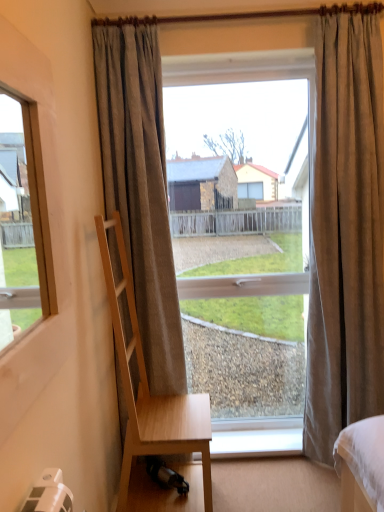
In order to face white plastic window sill at lower center, should I rotate leftwards or rightwards?

A 8.952 degree turn to the right will do.

Describe the element at coordinates (256, 437) in the screenshot. The height and width of the screenshot is (512, 384). I see `white plastic window sill at lower center` at that location.

The image size is (384, 512). Describe the element at coordinates (154, 410) in the screenshot. I see `light wood chair at left` at that location.

Find the location of `clear glass window at center`. clear glass window at center is located at coordinates (242, 227).

The width and height of the screenshot is (384, 512). What do you see at coordinates (242, 227) in the screenshot?
I see `clear glass window at center` at bounding box center [242, 227].

Where is `white plastic window sill at lower center`? The height and width of the screenshot is (512, 384). white plastic window sill at lower center is located at coordinates (256, 437).

From the image's perspective, which one is positioned higher, gray textured curtain at center, which is the first curtain in left-to-right order, or clear glass window at center?

From the image's view, clear glass window at center is above.

Where is `curtain that is below the clear glass window at center (from the image's perspective)`? The width and height of the screenshot is (384, 512). curtain that is below the clear glass window at center (from the image's perspective) is located at coordinates (140, 189).

Is gray textured curtain at center, which is the first curtain in left-to-right order, bigger than clear glass window at center?

No.

Between gray textured curtain at center, which is the first curtain in left-to-right order, and clear glass window at center, which one appears on the left side from the viewer's perspective?

gray textured curtain at center, which is the first curtain in left-to-right order.

From a real-world perspective, does white plastic window sill at lower center stand above clear glass window at center?

No, from a real-world perspective, white plastic window sill at lower center is not above clear glass window at center.

Which of these two, white plastic window sill at lower center or clear glass window at center, stands shorter?

With less height is white plastic window sill at lower center.

From the picture: Who is more distant, white plastic window sill at lower center or clear glass window at center?

white plastic window sill at lower center is further away from the camera.

From the image's perspective, between white plastic window sill at lower center and clear glass window at center, who is located below?

white plastic window sill at lower center, from the image's perspective.

Is clear glass window at center not close to white plastic window sill at lower center?

Yes, clear glass window at center is far from white plastic window sill at lower center.

Considering the positions of objects clear glass window at center and white plastic window sill at lower center in the image provided, who is in front, clear glass window at center or white plastic window sill at lower center?

clear glass window at center is closer to the camera.

Is clear glass window at center positioned with its back to white plastic window sill at lower center?

That's not correct — clear glass window at center is not looking away from white plastic window sill at lower center.

Consider the image. Between clear glass window at center and white plastic window sill at lower center, which one has larger width?

white plastic window sill at lower center.

Is brown textured curtain at right, which is the 2th curtain in left-to-right order, oriented towards white plastic window sill at lower center?

No, brown textured curtain at right, which is the 2th curtain in left-to-right order, is not turned towards white plastic window sill at lower center.

How far apart are brown textured curtain at right, the 1th curtain positioned from the right, and white plastic window sill at lower center?

brown textured curtain at right, the 1th curtain positioned from the right, and white plastic window sill at lower center are 26.43 inches apart.

Between brown textured curtain at right, which is the 2th curtain in left-to-right order, and white plastic window sill at lower center, which one has larger width?

Wider between the two is brown textured curtain at right, which is the 2th curtain in left-to-right order.

Which of these two, brown textured curtain at right, the 1th curtain positioned from the right, or white plastic window sill at lower center, stands taller?

Standing taller between the two is brown textured curtain at right, the 1th curtain positioned from the right.

Could you tell me if clear glass window at center is turned towards gray textured curtain at center, which is the first curtain in left-to-right order?

No.

From the image's perspective, is clear glass window at center over gray textured curtain at center, acting as the 2th curtain starting from the right?

Indeed, from the image's perspective, clear glass window at center is shown above gray textured curtain at center, acting as the 2th curtain starting from the right.

Which of these two, clear glass window at center or gray textured curtain at center, acting as the 2th curtain starting from the right, stands taller?

With more height is gray textured curtain at center, acting as the 2th curtain starting from the right.

From a real-world perspective, relative to gray textured curtain at center, which is the first curtain in left-to-right order, is clear glass window at center vertically above or below?

In terms of real-world spatial position, clear glass window at center is below gray textured curtain at center, which is the first curtain in left-to-right order.

Consider the image. Is light wood chair at left wider or thinner than white plastic window sill at lower center?

In the image, light wood chair at left appears to be wider than white plastic window sill at lower center.

From a real-world perspective, is light wood chair at left above or below white plastic window sill at lower center?

In terms of real-world spatial position, light wood chair at left is above white plastic window sill at lower center.

Considering the positions of points (153, 437) and (299, 449), is point (153, 437) farther from camera compared to point (299, 449)?

No.

You are a GUI agent. You are given a task and a screenshot of the screen. Output one action in this format:
    pyautogui.click(x=<x>, y=<y>)
    Task: Click on the chair lying on the left of white plastic window sill at lower center
    
    Given the screenshot: What is the action you would take?
    pyautogui.click(x=154, y=410)

The width and height of the screenshot is (384, 512). I want to click on chair that is in front of the brown textured curtain at right, the 1th curtain positioned from the right, so click(x=154, y=410).

Considering the relative positions of brown textured curtain at right, the 1th curtain positioned from the right, and light wood chair at left in the image provided, is brown textured curtain at right, the 1th curtain positioned from the right, to the left of light wood chair at left from the viewer's perspective?

In fact, brown textured curtain at right, the 1th curtain positioned from the right, is to the right of light wood chair at left.

What's the angular difference between brown textured curtain at right, the 1th curtain positioned from the right, and light wood chair at left's facing directions?

88 degrees separate the facing orientations of brown textured curtain at right, the 1th curtain positioned from the right, and light wood chair at left.

Is brown textured curtain at right, which is the 2th curtain in left-to-right order, spatially inside light wood chair at left, or outside of it?

brown textured curtain at right, which is the 2th curtain in left-to-right order, cannot be found inside light wood chair at left.

You are a GUI agent. You are given a task and a screenshot of the screen. Output one action in this format:
    pyautogui.click(x=<x>, y=<y>)
    Task: Click on the window behind the gray textured curtain at center, which is the first curtain in left-to-right order
    The height and width of the screenshot is (512, 384).
    Given the screenshot: What is the action you would take?
    pyautogui.click(x=242, y=227)

The image size is (384, 512). Find the location of `window above the white plastic window sill at lower center (from the image's perspective)`. window above the white plastic window sill at lower center (from the image's perspective) is located at coordinates (242, 227).

Based on their spatial positions, is gray textured curtain at center, which is the first curtain in left-to-right order, or brown textured curtain at right, which is the 2th curtain in left-to-right order, further from light wood chair at left?

brown textured curtain at right, which is the 2th curtain in left-to-right order, is further to light wood chair at left.

From the image, which object appears to be nearer to white plastic window sill at lower center, light wood chair at left or clear glass window at center?

light wood chair at left is closer to white plastic window sill at lower center.

From the image, which object appears to be farther from white plastic window sill at lower center, light wood chair at left or gray textured curtain at center, acting as the 2th curtain starting from the right?

gray textured curtain at center, acting as the 2th curtain starting from the right.

When comparing their distances from clear glass window at center, does white plastic window sill at lower center or brown textured curtain at right, which is the 2th curtain in left-to-right order, seem further?

white plastic window sill at lower center.

Looking at the image, which one is located further to clear glass window at center, gray textured curtain at center, which is the first curtain in left-to-right order, or light wood chair at left?

The object further to clear glass window at center is light wood chair at left.

When comparing their distances from gray textured curtain at center, which is the first curtain in left-to-right order, does white plastic window sill at lower center or light wood chair at left seem closer?

light wood chair at left is positioned closer to the anchor gray textured curtain at center, which is the first curtain in left-to-right order.

Estimate the real-world distances between objects in this image. Which object is further from white plastic window sill at lower center, clear glass window at center or light wood chair at left?

Among the two, clear glass window at center is located further to white plastic window sill at lower center.

Based on their spatial positions, is white plastic window sill at lower center or clear glass window at center further from light wood chair at left?

Among the two, clear glass window at center is located further to light wood chair at left.

Locate an element on the screen. Image resolution: width=384 pixels, height=512 pixels. chair between clear glass window at center and white plastic window sill at lower center in the vertical direction is located at coordinates (154, 410).

Identify the location of window between light wood chair at left and brown textured curtain at right, the 1th curtain positioned from the right. This screenshot has width=384, height=512. (242, 227).

I want to click on chair between brown textured curtain at right, the 1th curtain positioned from the right, and white plastic window sill at lower center, in the vertical direction, so click(x=154, y=410).

Where is `curtain between clear glass window at center and white plastic window sill at lower center from top to bottom`? This screenshot has height=512, width=384. curtain between clear glass window at center and white plastic window sill at lower center from top to bottom is located at coordinates click(140, 189).